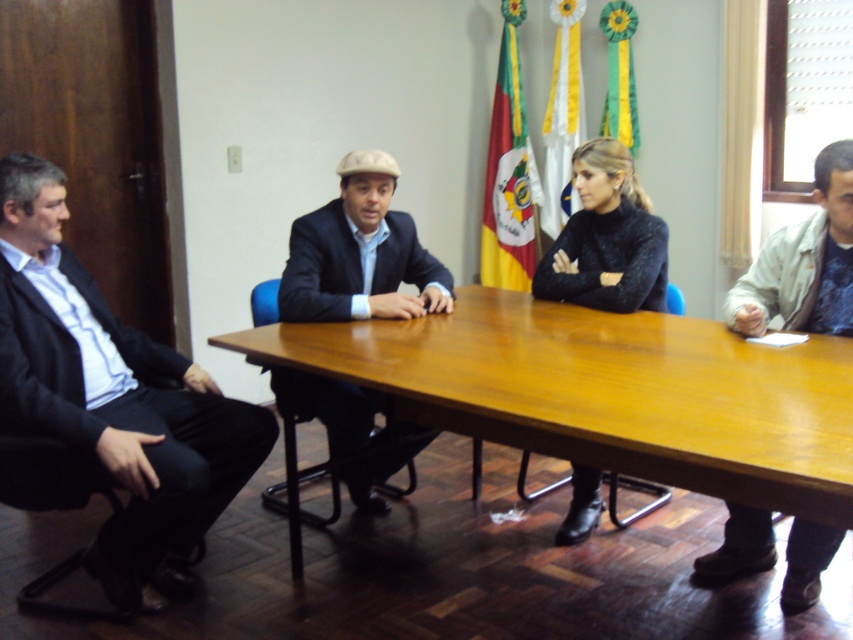
You are sitting at the long wooden table in the conference room. You see two points marked on the table surface. One is at point [21,340] and the other is at point [631,177]. If you want to reach the point that is closer to you, which one should you choose?

You should choose point [21,340] because it is in front of point [631,177], meaning it is closer to your current position at the table.

In the formal meeting scene, there is a dark blue suit at left and a point marked at coordinates (112, 397). Which object does this point correspond to?

The point at coordinates (112, 397) corresponds to the dark blue suit at left.

You are a server in a restaurant and need to place a 20 inch platter between the light beige jacket at right and the black fuzzy sweater at center. Can you fit it there?

The light beige jacket at right and black fuzzy sweater at center are 19.93 inches apart from each other. Since the platter is 20 inches wide, it is slightly wider than the available space. Therefore, the platter cannot be placed between them.